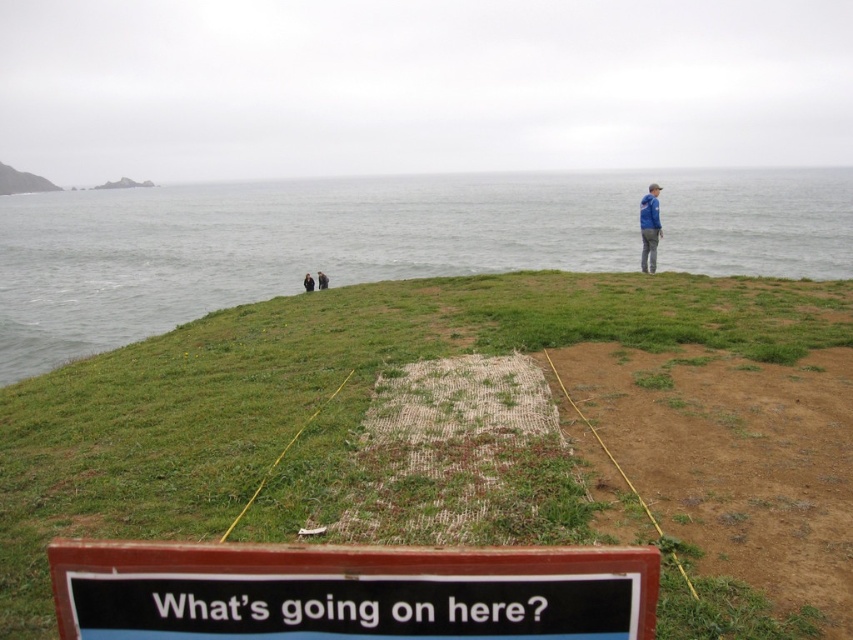
Is black plastic sign at lower center below blue fabric jacket at upper right?

Yes, black plastic sign at lower center is below blue fabric jacket at upper right.

The height and width of the screenshot is (640, 853). Find the location of `black plastic sign at lower center`. black plastic sign at lower center is located at coordinates (350, 592).

This screenshot has width=853, height=640. What are the coordinates of `black plastic sign at lower center` in the screenshot? It's located at (350, 592).

Consider the image. Does green grassy at center appear over black fabric person at lower left?

No.

What do you see at coordinates (341, 413) in the screenshot?
I see `green grassy at center` at bounding box center [341, 413].

Measure the distance between green grassy at center and camera.

green grassy at center is 3.15 meters from camera.

Image resolution: width=853 pixels, height=640 pixels. What are the coordinates of `green grassy at center` in the screenshot? It's located at (341, 413).

Looking at this image, does green grassy at center lie behind dark blue jacket at center?

No, it is not.

Is point (556, 464) farther from viewer compared to point (306, 280)?

No, (556, 464) is in front of (306, 280).

Image resolution: width=853 pixels, height=640 pixels. What do you see at coordinates (341, 413) in the screenshot?
I see `green grassy at center` at bounding box center [341, 413].

Where is `green grassy at center`? green grassy at center is located at coordinates point(341,413).